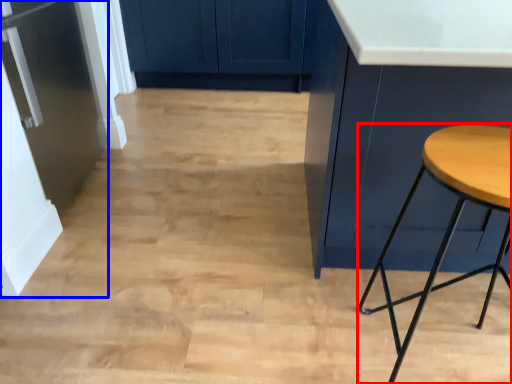
Question: Which object appears farthest to the camera in this image, stool (highlighted by a red box) or fridge (highlighted by a blue box)?

Choices:
 (A) stool
 (B) fridge

Answer: (B)